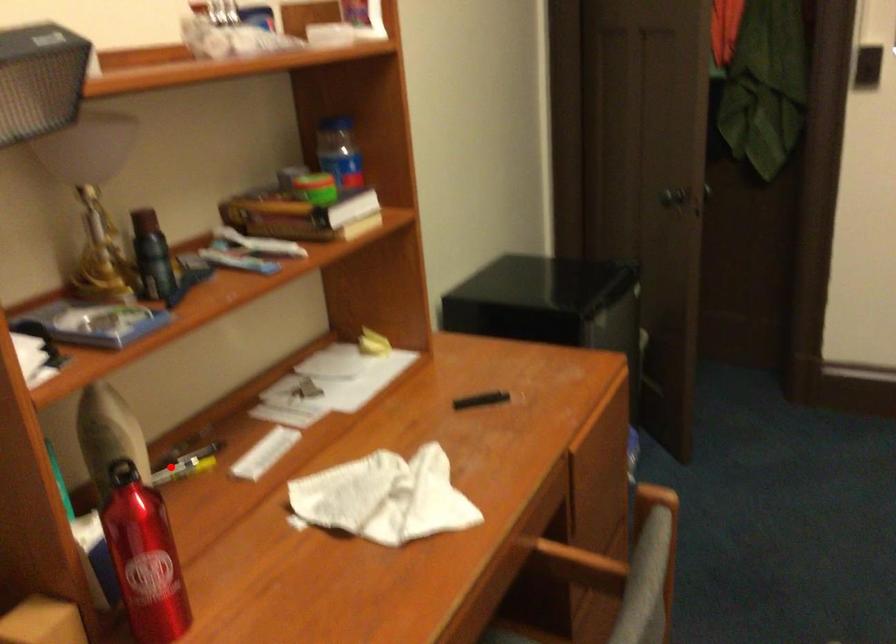
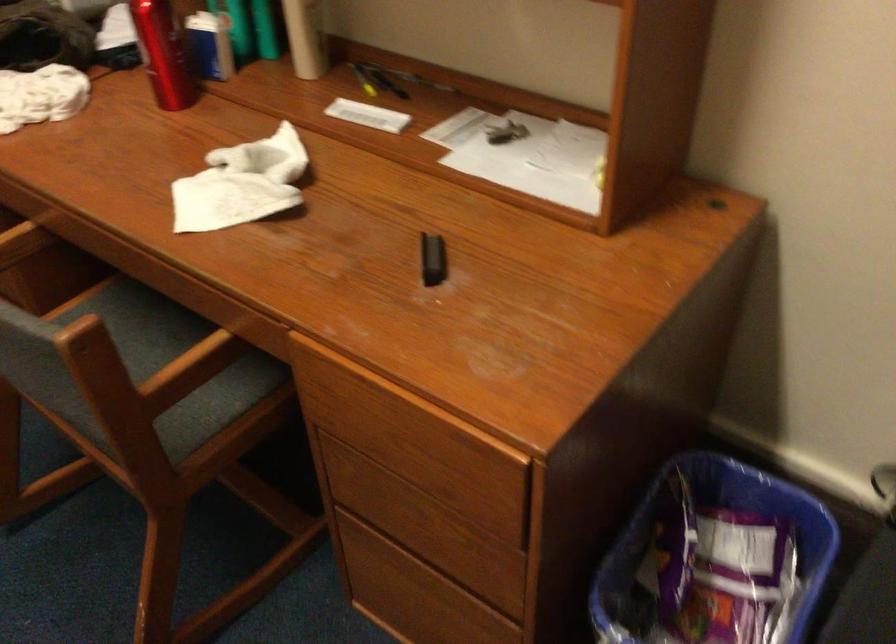
Question: A red point is marked in image1. In image2, is the corresponding 3D point closer to the camera or farther? Reply with the corresponding letter.

Choices:
 (A) The corresponding 3D point is closer.
 (B) The corresponding 3D point is farther.

Answer: (B)